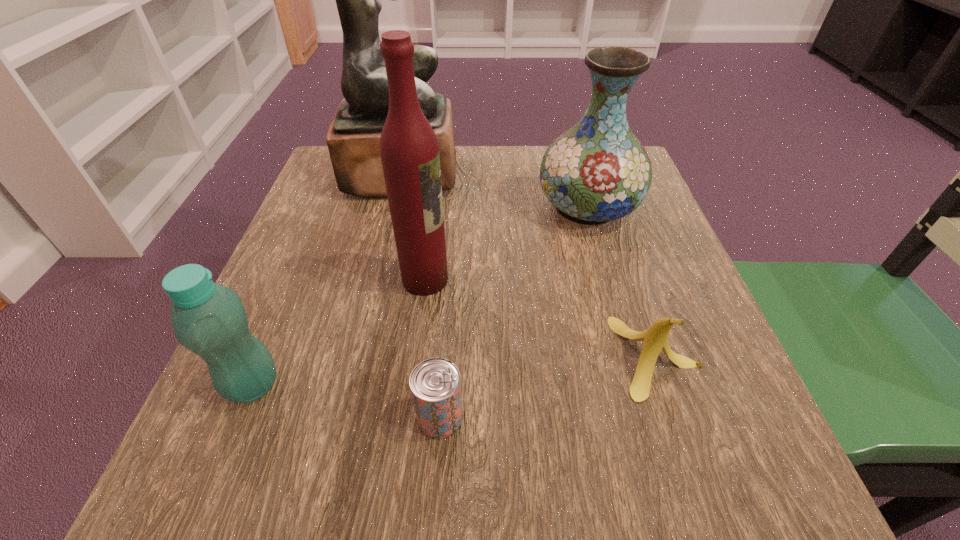
I want to click on free point located 0.160m at the front cap of the third shortest object, so click(x=390, y=384).

Find the location of `vacant space located 0.220m on the back of the second shortest object`. vacant space located 0.220m on the back of the second shortest object is located at coordinates (615, 234).

Locate an element on the screen. Image resolution: width=960 pixels, height=540 pixels. vacant space located on the right of the shortest object is located at coordinates pos(671,417).

The height and width of the screenshot is (540, 960). In order to click on sculpture at the far edge in this screenshot , I will do `click(353, 139)`.

The height and width of the screenshot is (540, 960). Identify the location of vase at the far edge. (597, 171).

Locate an element on the screen. The height and width of the screenshot is (540, 960). object that is at the near edge is located at coordinates (435, 383).

Locate an element on the screen. The height and width of the screenshot is (540, 960). sculpture present at the left edge is located at coordinates (353, 139).

Find the location of a particular element. The image size is (960, 540). water bottle located at the left edge is located at coordinates (209, 319).

The image size is (960, 540). What are the coordinates of `vase located in the right edge section of the desktop` in the screenshot? It's located at (597, 171).

The width and height of the screenshot is (960, 540). What are the coordinates of `banana at the right edge` in the screenshot? It's located at (656, 338).